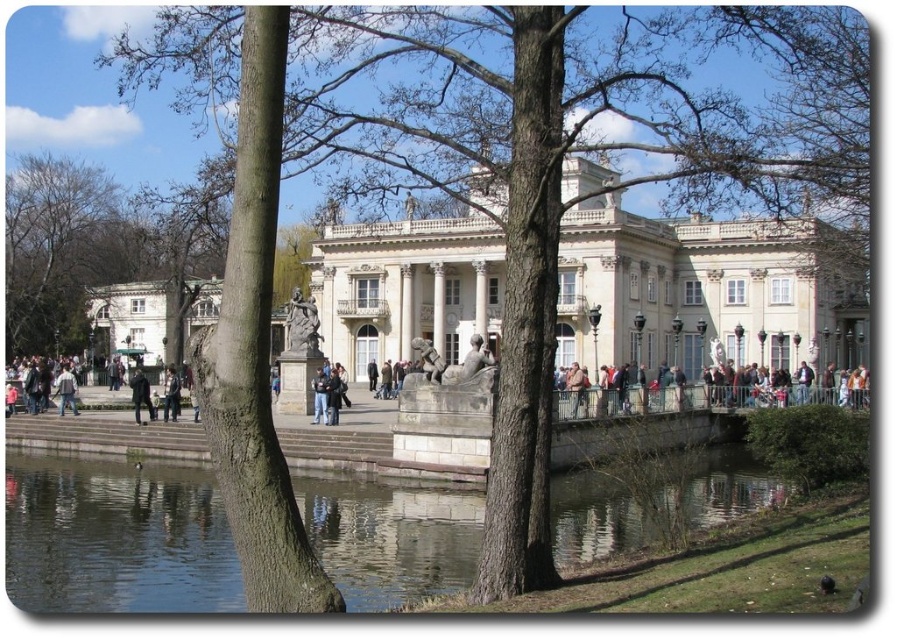
You are a visitor at the park and want to take a photo of the white marble palace at center without the dark blue jeans at center appearing in the frame. Is it possible to do so given their sizes?

The white marble palace at center is larger than the dark blue jeans at center. Since the palace is bigger, you can position yourself or adjust your camera angle to exclude the jeans from the frame by focusing on the larger structure.

You are standing on the stone walkway near the water and want to take a photo of the grand building while including both the clear water at pond center and the bare wood tree at upper left in the frame. Which object should be placed to the right in your photo composition?

The clear water at pond center should be placed to the right in your photo composition because it is positioned on the right side of the bare wood tree at upper left.